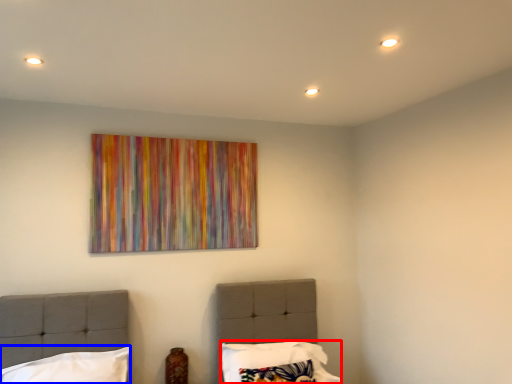
Question: Among these objects, which one is nearest to the camera, pillow (highlighted by a red box) or pillow (highlighted by a blue box)?

Choices:
 (A) pillow
 (B) pillow

Answer: (B)